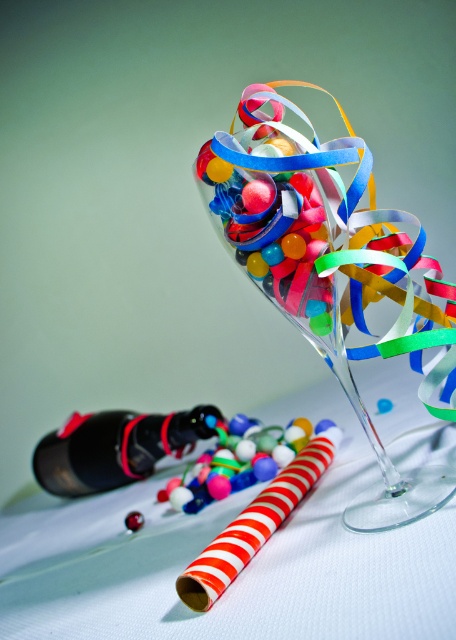
Can you confirm if translucent glass martini glass at center is shorter than black matte bottle at lower left?

No, translucent glass martini glass at center is not shorter than black matte bottle at lower left.

Does translucent glass martini glass at center appear on the right side of black matte bottle at lower left?

Yes, translucent glass martini glass at center is to the right of black matte bottle at lower left.

Is point (408, 268) closer to viewer compared to point (208, 410)?

Yes, it is.

This screenshot has height=640, width=456. I want to click on translucent glass martini glass at center, so click(x=333, y=273).

Is black matte bottle at lower left further to the viewer compared to shiny multicolored beads at center?

Yes, black matte bottle at lower left is behind shiny multicolored beads at center.

Can you confirm if black matte bottle at lower left is wider than shiny multicolored beads at center?

Yes, black matte bottle at lower left is wider than shiny multicolored beads at center.

Find the location of a particular element. The width and height of the screenshot is (456, 640). black matte bottle at lower left is located at coordinates (115, 448).

The height and width of the screenshot is (640, 456). Identify the location of black matte bottle at lower left. (115, 448).

Which is in front, point (267, 113) or point (250, 442)?

Point (267, 113) is more forward.

Could you measure the distance between translucent glass martini glass at center and shiny multicolored beads at center?

translucent glass martini glass at center is 28.92 centimeters from shiny multicolored beads at center.

What are the coordinates of `translucent glass martini glass at center` in the screenshot? It's located at (333, 273).